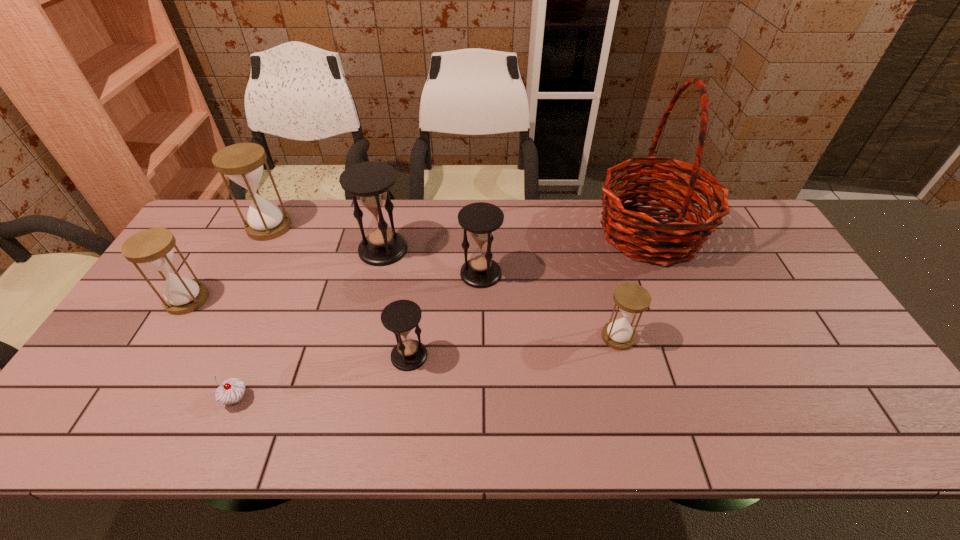
The height and width of the screenshot is (540, 960). What are the coordinates of `vacant space situated on the right of the nearest object` in the screenshot? It's located at (361, 399).

This screenshot has width=960, height=540. I want to click on basket that is at the far edge, so click(672, 238).

Image resolution: width=960 pixels, height=540 pixels. Find the location of `object at the near edge`. object at the near edge is located at coordinates coord(231,391).

You are a GUI agent. You are given a task and a screenshot of the screen. Output one action in this format:
    pyautogui.click(x=<x>, y=<y>)
    Task: Click on the object situated at the left edge
    
    Given the screenshot: What is the action you would take?
    pyautogui.click(x=153, y=248)

In the image, there is a desktop. Identify the location of vacant area at the far edge. (530, 238).

Identify the location of vacant region at the near edge of the desktop. The height and width of the screenshot is (540, 960). (647, 423).

Image resolution: width=960 pixels, height=540 pixels. Find the location of `free spot at the left edge of the desktop`. free spot at the left edge of the desktop is located at coordinates (148, 339).

Identify the location of free spot at the far left corner of the desktop. (206, 219).

You are a GUI agent. You are given a task and a screenshot of the screen. Output one action in this format:
    pyautogui.click(x=<x>, y=<y>)
    Task: Click on the vacant area at the far right corner of the desktop
    This screenshot has height=540, width=960.
    Given the screenshot: What is the action you would take?
    pyautogui.click(x=724, y=224)

Find the location of a particular element. The height and width of the screenshot is (540, 960). blank space at the near right corner of the desktop is located at coordinates (883, 438).